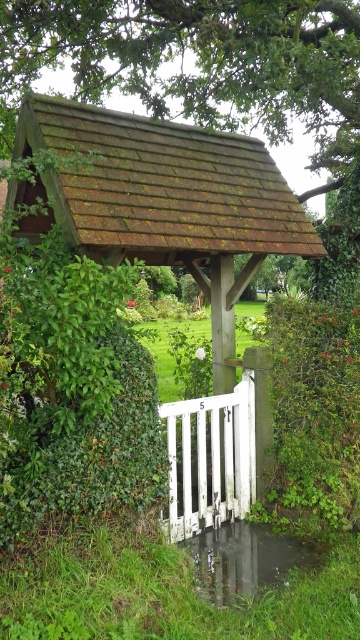
Is the position of white painted wood gate at center less distant than that of glossy concrete puddle at lower center?

That is False.

Does point (240, 406) come behind point (249, 557)?

Yes, it is.

Image resolution: width=360 pixels, height=640 pixels. Describe the element at coordinates (209, 460) in the screenshot. I see `white painted wood gate at center` at that location.

Identify the location of white painted wood gate at center. The height and width of the screenshot is (640, 360). (209, 460).

You are a GUI agent. You are given a task and a screenshot of the screen. Output one action in this format:
    pyautogui.click(x=<x>, y=<y>)
    Task: Click on the green mossy roof at upper center
    
    Given the screenshot: What is the action you would take?
    pyautogui.click(x=217, y=77)

Does green mossy roof at upper center appear over glossy concrete puddle at lower center?

Indeed, green mossy roof at upper center is positioned over glossy concrete puddle at lower center.

Is point (57, 61) in front of point (253, 564)?

That is False.

The width and height of the screenshot is (360, 640). What are the coordinates of `green mossy roof at upper center` in the screenshot? It's located at (217, 77).

Find the location of a particular element. Image resolution: width=360 pixels, height=640 pixels. green mossy roof at upper center is located at coordinates (217, 77).

The width and height of the screenshot is (360, 640). What are the coordinates of `green mossy roof at upper center` in the screenshot? It's located at (217, 77).